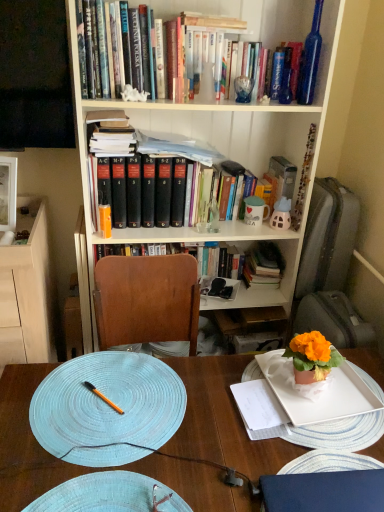
The width and height of the screenshot is (384, 512). In order to click on vacant region under blue woven placemat at center, arranged as the 1th plate when viewed from the left (from a real-world perspective) in this screenshot , I will do `click(101, 417)`.